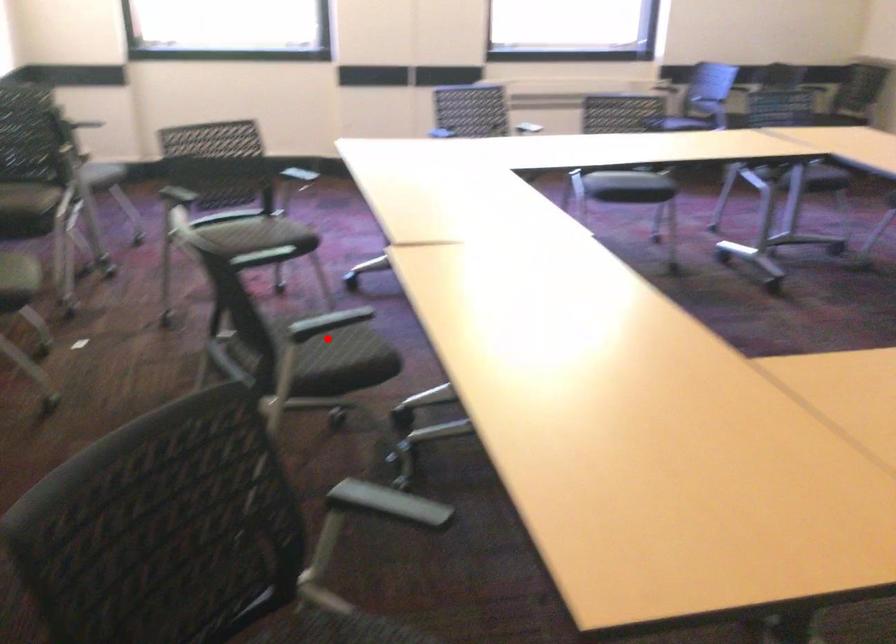
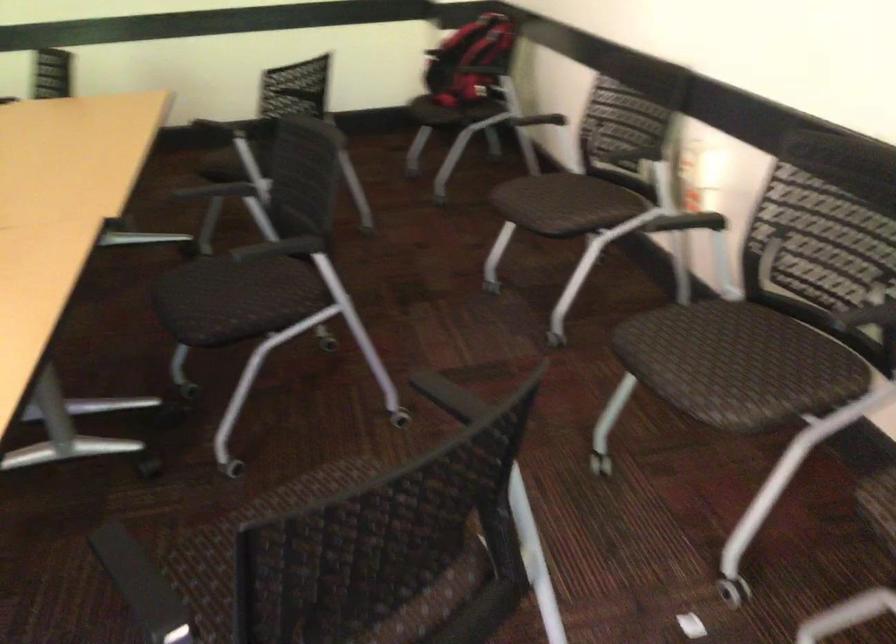
Where in the second image is the point corresponding to the highlighted location from the first image?

(222, 301)